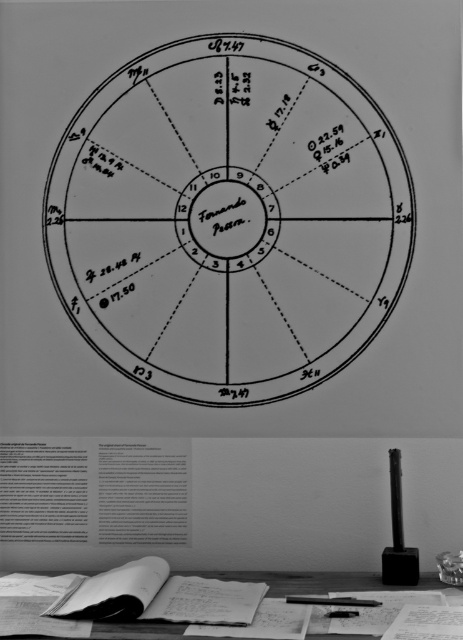
Can you confirm if black ink circle at center is positioned above smooth wooden table at lower center?

Yes.

What do you see at coordinates (229, 220) in the screenshot? I see `black ink circle at center` at bounding box center [229, 220].

At what (x,y) coordinates should I click in order to perform the action: click on black ink circle at center. Please return your answer as a coordinate pair (x, y). The height and width of the screenshot is (640, 463). Looking at the image, I should click on (229, 220).

In the scene shown: Which is below, black ink circle at center or black plastic pen at lower center?

black plastic pen at lower center is below.

Consider the image. Does black ink circle at center have a larger size compared to black plastic pen at lower center?

Yes, black ink circle at center is bigger than black plastic pen at lower center.

Between point (216, 67) and point (294, 596), which one is positioned behind?

The point (216, 67) is more distant.

This screenshot has height=640, width=463. I want to click on black ink circle at center, so click(x=229, y=220).

Is smooth wooden table at lower center in front of black plastic pen at lower center?

That is True.

Looking at this image, does smooth wooden table at lower center appear on the left side of black plastic pen at lower center?

Indeed, smooth wooden table at lower center is positioned on the left side of black plastic pen at lower center.

Which is in front, point (269, 580) or point (317, 604)?

Point (317, 604) is in front.

Find the location of `smooth wooden table at lower center`. smooth wooden table at lower center is located at coordinates (312, 580).